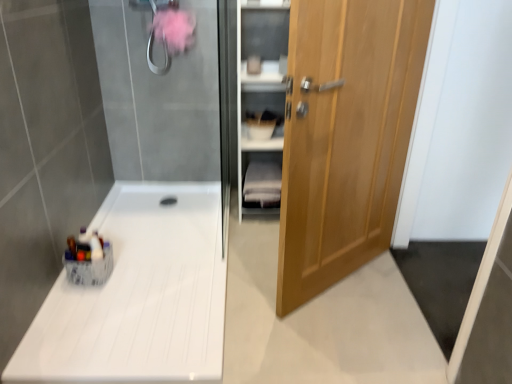
Question: Considering the positions of point (344, 253) and point (274, 152), is point (344, 253) closer or farther from the camera than point (274, 152)?

Choices:
 (A) closer
 (B) farther

Answer: (A)

Question: From the image's perspective, is light brown wooden door at right located above or below wooden cabinet at right?

Choices:
 (A) below
 (B) above

Answer: (A)

Question: Which of these objects is positioned farthest from the wooden cabinet at right?

Choices:
 (A) light brown wooden door at right
 (B) white glossy counter top at lower left
 (C) white fabric shelf at center

Answer: (A)

Question: Estimate the real-world distances between objects in this image. Which object is closer to the white glossy counter top at lower left?

Choices:
 (A) white fabric shelf at center
 (B) light brown wooden door at right
 (C) wooden cabinet at right

Answer: (A)